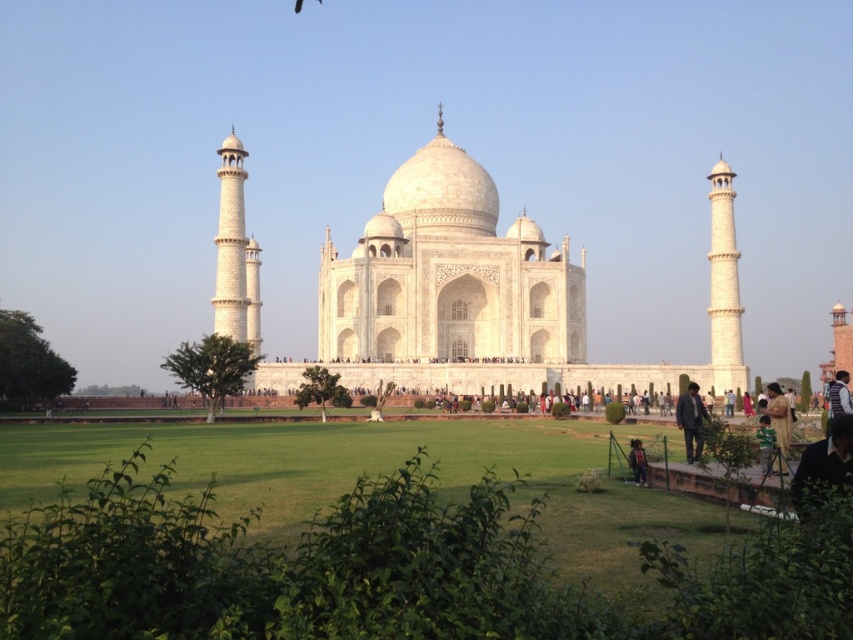
Question: Which point is closer to the camera?

Choices:
 (A) (347, 541)
 (B) (682, 410)
 (C) (643, 449)
 (D) (767, 387)

Answer: (A)

Question: Which of the following is the closest to the observer?

Choices:
 (A) (630, 445)
 (B) (103, 486)
 (C) (772, 396)

Answer: (B)

Question: Can you confirm if green grass at center is positioned below dark brown leather jacket at lower right?

Choices:
 (A) yes
 (B) no

Answer: (A)

Question: Which object appears farthest from the camera in this image?

Choices:
 (A) yellow fabric dress at lower right
 (B) green fabric person at lower right
 (C) dark blue suit at lower right
 (D) green grass at center

Answer: (C)

Question: Can you confirm if yellow fabric dress at lower right is positioned to the left of dark brown leather jacket at lower right?

Choices:
 (A) yes
 (B) no

Answer: (B)

Question: Does green grass at center appear under yellow fabric dress at lower right?

Choices:
 (A) yes
 (B) no

Answer: (A)